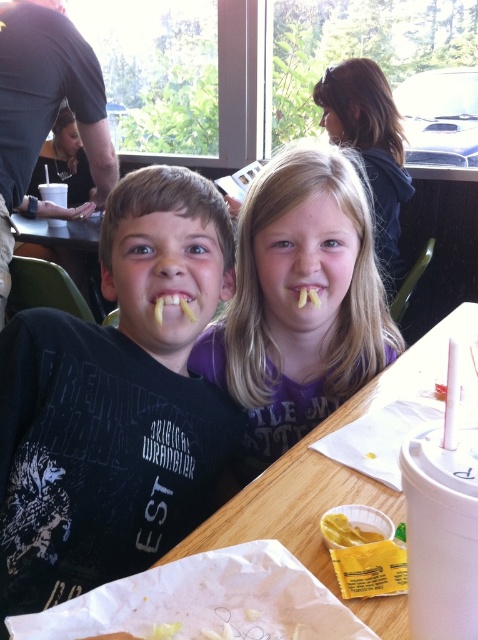
You are a tailor measuring the width of the matte purple shirt at center and the yellow french fries at mouth. Which item is wider?

The matte purple shirt at center is wider than the yellow french fries at mouth.

You are a photographer trying to capture a candid shot of the children. The matte purple shirt at center and the yellow french fries at mouth are both in your frame. Which object is taller in the image?

The matte purple shirt at center is taller than the yellow french fries at mouth.

You are a photographer trying to capture a candid shot of the two children. You notice the matte purple shirt at center and the yellow french fries at mouth. Which object is positioned to the right of the other?

The matte purple shirt at center is to the right of yellow french fries at mouth.